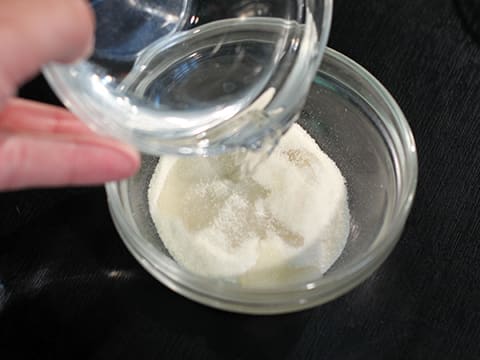
What are the coordinates of `powder that fell on black countertop` in the screenshot? It's located at (109, 276).